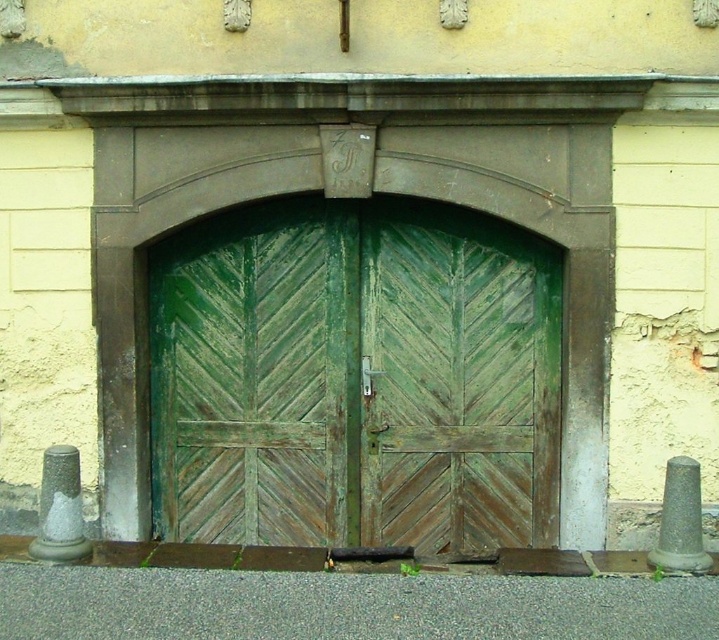
Consider the image. Which of these two, green wood/glass doors at center or green wood door at center, stands taller?

green wood/glass doors at center

Which is more to the left, green wood/glass doors at center or green wood door at center?

From the viewer's perspective, green wood/glass doors at center appears more on the left side.

You are a GUI agent. You are given a task and a screenshot of the screen. Output one action in this format:
    pyautogui.click(x=<x>, y=<y>)
    Task: Click on the green wood/glass doors at center
    
    Given the screenshot: What is the action you would take?
    pyautogui.click(x=354, y=378)

Image resolution: width=719 pixels, height=640 pixels. I want to click on green wood/glass doors at center, so click(354, 378).

Who is more distant from viewer, (244, 381) or (487, 328)?

Point (244, 381)

Is green weathered wood door at center bigger than green wood door at center?

Yes, green weathered wood door at center is bigger than green wood door at center.

What do you see at coordinates (257, 376) in the screenshot? This screenshot has height=640, width=719. I see `green weathered wood door at center` at bounding box center [257, 376].

Locate an element on the screen. The width and height of the screenshot is (719, 640). green weathered wood door at center is located at coordinates (257, 376).

Looking at this image, can you confirm if green wood/glass doors at center is positioned above green weathered wood door at center?

No.

Can you confirm if green wood/glass doors at center is thinner than green weathered wood door at center?

No.

I want to click on green wood/glass doors at center, so click(354, 378).